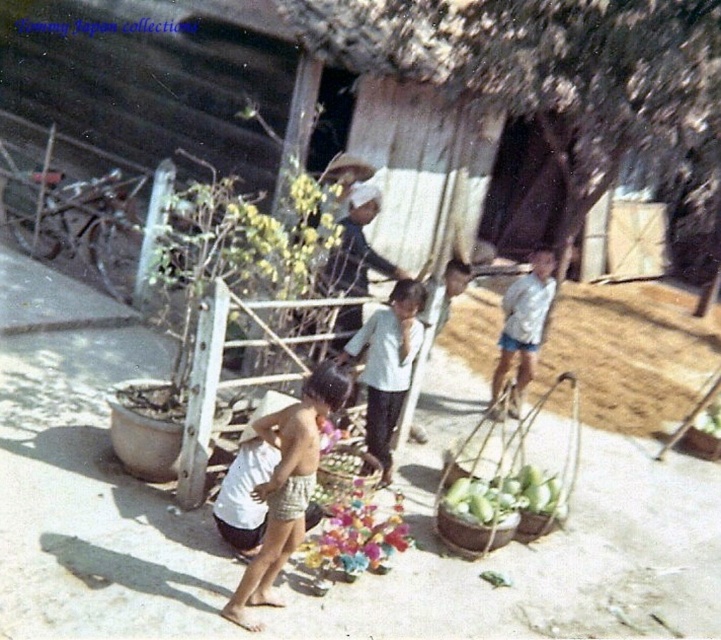
Is point (570, 483) less distant than point (329, 488)?

No, it is behind (329, 488).

Can you confirm if brown woven basket at lower right is positioned above multicolored woven basket at center?

Correct, brown woven basket at lower right is located above multicolored woven basket at center.

Is point (544, 525) positioned in front of point (368, 470)?

Yes, it is in front of point (368, 470).

Locate an element on the screen. The width and height of the screenshot is (721, 640). brown woven basket at lower right is located at coordinates (505, 484).

Which is in front, point (373, 556) or point (544, 488)?

Positioned in front is point (373, 556).

This screenshot has height=640, width=721. What are the coordinates of `multicolored fabric at lower center` in the screenshot? It's located at (358, 538).

The width and height of the screenshot is (721, 640). What do you see at coordinates (287, 484) in the screenshot?
I see `light brown shorts at center` at bounding box center [287, 484].

Who is more distant from viewer, (267, 529) or (350, 548)?

The point (350, 548) is more distant.

Where is `light brown shorts at center`? light brown shorts at center is located at coordinates click(x=287, y=484).